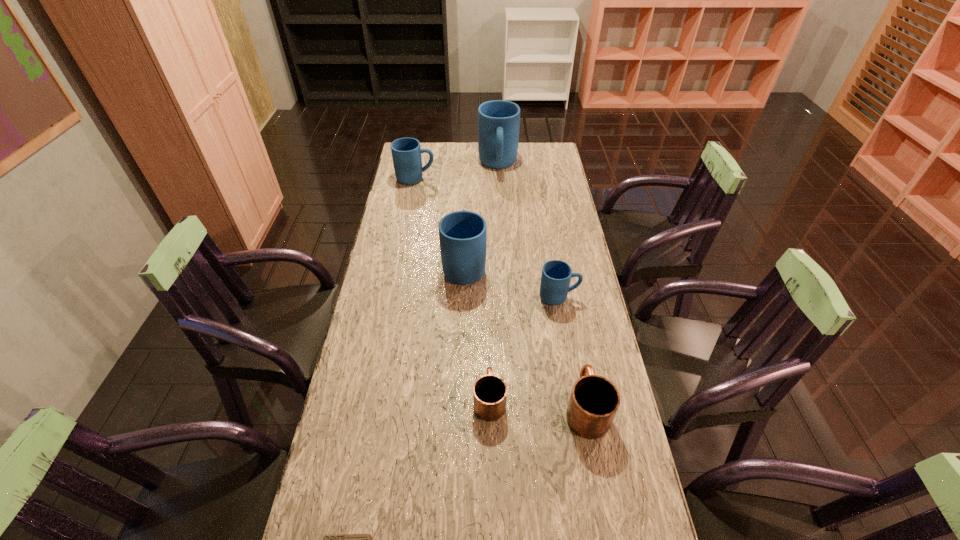
Image resolution: width=960 pixels, height=540 pixels. Identify the location of the tallest object. (498, 121).

Find the location of a particular element. This screenshot has height=540, width=960. the biggest blue mug is located at coordinates (498, 121).

Locate an element on the screen. Image resolution: width=960 pixels, height=540 pixels. the second tallest mug is located at coordinates (462, 234).

You are a GUI agent. You are given a task and a screenshot of the screen. Output one action in this format:
    pyautogui.click(x=<x>, y=<y>)
    Task: Click on the sixth shortest object
    
    Given the screenshot: What is the action you would take?
    pyautogui.click(x=462, y=234)

Where is `the leftmost blue mug`? Image resolution: width=960 pixels, height=540 pixels. the leftmost blue mug is located at coordinates (406, 152).

Identify the location of the second smallest blue mug. (406, 152).

You are a GUI agent. You are given a task and a screenshot of the screen. Output one action in this format:
    pyautogui.click(x=<x>, y=<y>)
    Task: Click on the smallest blue mug
    The height and width of the screenshot is (540, 960).
    Given the screenshot: What is the action you would take?
    pyautogui.click(x=556, y=275)

Where is `the right rust mug`? This screenshot has height=540, width=960. the right rust mug is located at coordinates (594, 401).

The image size is (960, 540). Identify the location of the second shortest object. (489, 391).

Image resolution: width=960 pixels, height=540 pixels. What are the coordinates of `the smaller rust mug` in the screenshot? It's located at (489, 391).